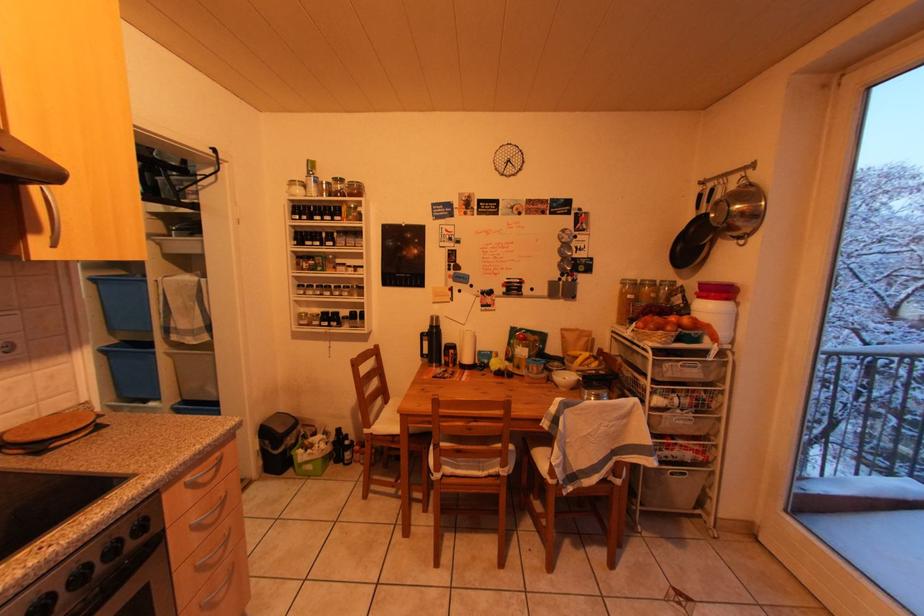
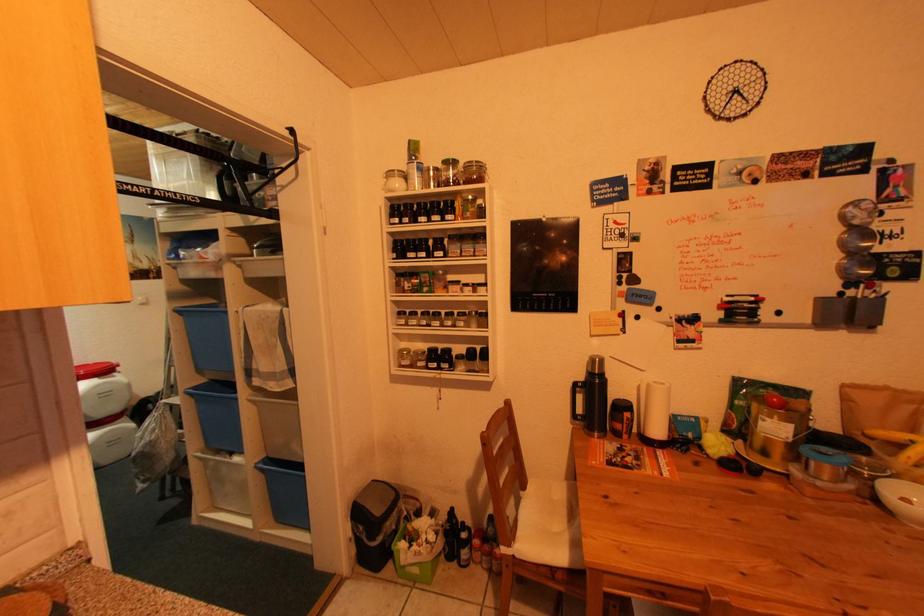
Question: How did the camera likely rotate?

Choices:
 (A) Left
 (B) Right
 (C) Up
 (D) Down

Answer: (A)